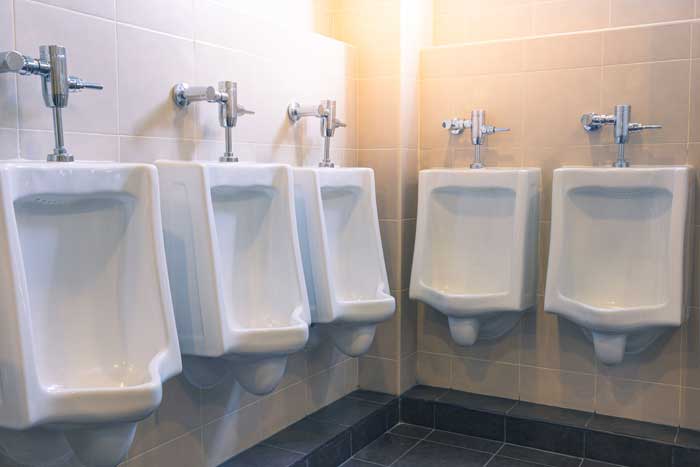
Image resolution: width=700 pixels, height=467 pixels. Identify the location of flush handles. [636, 125], [490, 130], [343, 122], [248, 109], [90, 84].